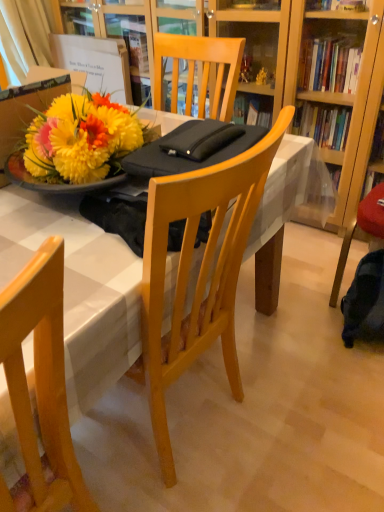
Question: Considering the relative positions of white fabric curtain at upper left and white glossy table at center in the image provided, is white fabric curtain at upper left to the right of white glossy table at center from the viewer's perspective?

Choices:
 (A) yes
 (B) no

Answer: (B)

Question: Can you confirm if white fabric curtain at upper left is thinner than white glossy table at center?

Choices:
 (A) no
 (B) yes

Answer: (B)

Question: Is white glossy table at center at the back of white fabric curtain at upper left?

Choices:
 (A) yes
 (B) no

Answer: (B)

Question: Is white fabric curtain at upper left taller than white glossy table at center?

Choices:
 (A) yes
 (B) no

Answer: (B)

Question: Is white fabric curtain at upper left bigger than white glossy table at center?

Choices:
 (A) no
 (B) yes

Answer: (A)

Question: From the image's perspective, is white fabric curtain at upper left located above white glossy table at center?

Choices:
 (A) no
 (B) yes

Answer: (B)

Question: Is white fabric curtain at upper left outside of light wood chair at lower left?

Choices:
 (A) no
 (B) yes

Answer: (B)

Question: Does white fabric curtain at upper left come behind light wood chair at lower left?

Choices:
 (A) yes
 (B) no

Answer: (A)

Question: Is light wood chair at lower left located within white fabric curtain at upper left?

Choices:
 (A) no
 (B) yes

Answer: (A)

Question: Is white fabric curtain at upper left bigger than light wood chair at lower left?

Choices:
 (A) no
 (B) yes

Answer: (A)

Question: From a real-world perspective, is white fabric curtain at upper left located beneath light wood chair at lower left?

Choices:
 (A) yes
 (B) no

Answer: (B)

Question: Is white fabric curtain at upper left far away from light wood chair at lower left?

Choices:
 (A) no
 (B) yes

Answer: (B)

Question: From the image's perspective, is light wood chair at lower left on top of white glossy table at center?

Choices:
 (A) no
 (B) yes

Answer: (A)